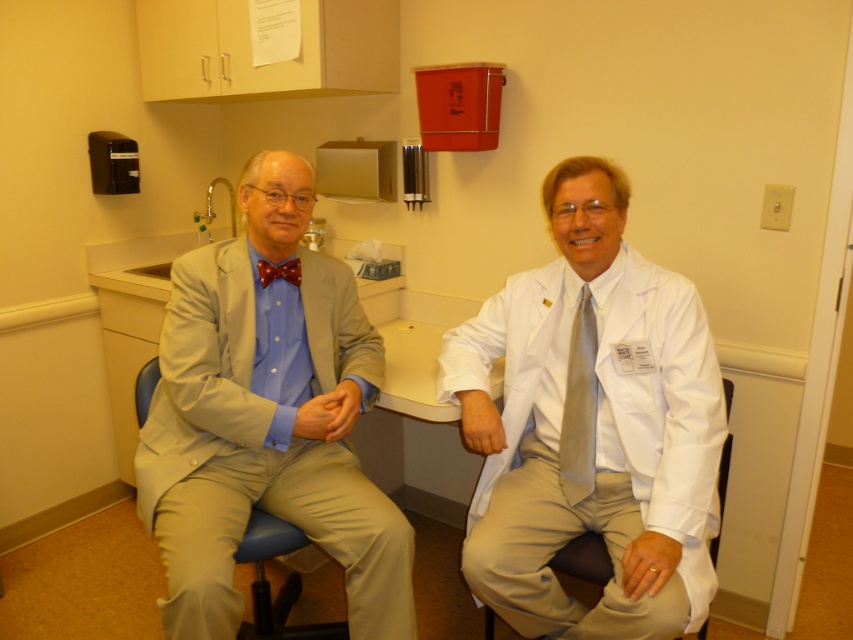
You are a patient in the medical examination room and need to sit down. There is a smooth plastic swivel chair at center and a silvery smooth tie at center. Which object is closer to you so you can sit safely?

The silvery smooth tie at center is closer to you than the smooth plastic swivel chair at center, so you should move past it to reach the chair safely.